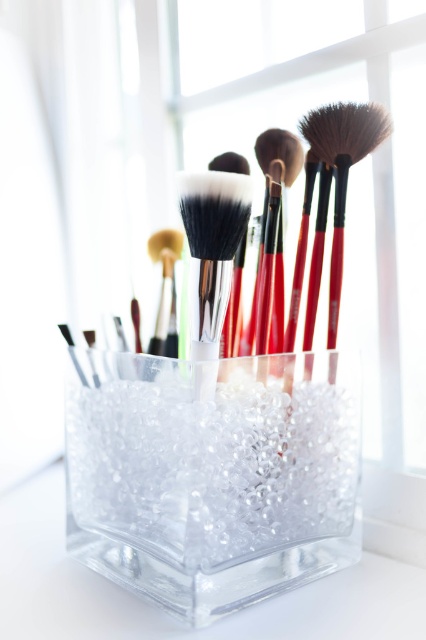
Does clear crystal glass at center have a greater width compared to soft white bristles at center?

Correct, the width of clear crystal glass at center exceeds that of soft white bristles at center.

Consider the image. Who is positioned more to the right, clear crystal glass at center or soft white bristles at center?

From the viewer's perspective, soft white bristles at center appears more on the right side.

Locate an element on the screen. This screenshot has height=640, width=426. clear crystal glass at center is located at coordinates (212, 474).

Is soft white bristles at center shorter than brown synthetic hair brush at upper right?

Indeed, soft white bristles at center has a lesser height compared to brown synthetic hair brush at upper right.

Which is more to the left, soft white bristles at center or brown synthetic hair brush at upper right?

soft white bristles at center

Who is more distant from viewer, (195, 328) or (356, 157)?

The point (356, 157) is more distant.

The height and width of the screenshot is (640, 426). In order to click on soft white bristles at center in this screenshot , I will do `click(210, 260)`.

Which is in front, point (328, 426) or point (158, 241)?

Point (328, 426)

Does clear crystal glass at center come in front of matte black brush at center?

Yes, it is in front of matte black brush at center.

Is point (233, 369) less distant than point (163, 289)?

Yes, it is.

Locate an element on the screen. This screenshot has height=640, width=426. clear crystal glass at center is located at coordinates (212, 474).